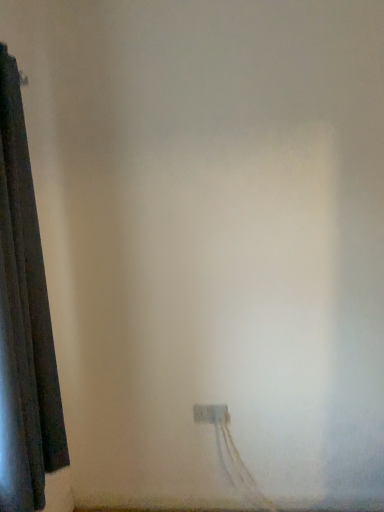
Question: Should I look upward or downward to see white plastic power plugs and sockets at lower center?

Choices:
 (A) up
 (B) down

Answer: (B)

Question: Is there a large distance between white plastic power plugs and sockets at lower center and dark fabric curtain at left?

Choices:
 (A) yes
 (B) no

Answer: (B)

Question: Is dark fabric curtain at left completely or partially inside white plastic power plugs and sockets at lower center?

Choices:
 (A) no
 (B) yes

Answer: (A)

Question: Considering the relative sizes of white plastic power plugs and sockets at lower center and dark fabric curtain at left in the image provided, is white plastic power plugs and sockets at lower center bigger than dark fabric curtain at left?

Choices:
 (A) no
 (B) yes

Answer: (A)

Question: Does white plastic power plugs and sockets at lower center have a greater width compared to dark fabric curtain at left?

Choices:
 (A) no
 (B) yes

Answer: (A)

Question: Is white plastic power plugs and sockets at lower center oriented towards dark fabric curtain at left?

Choices:
 (A) yes
 (B) no

Answer: (B)

Question: Considering the relative sizes of white plastic power plugs and sockets at lower center and dark fabric curtain at left in the image provided, is white plastic power plugs and sockets at lower center taller than dark fabric curtain at left?

Choices:
 (A) no
 (B) yes

Answer: (A)

Question: Does dark fabric curtain at left have a larger size compared to white plastic power plugs and sockets at lower center?

Choices:
 (A) yes
 (B) no

Answer: (A)

Question: Can you confirm if dark fabric curtain at left is shorter than white plastic power plugs and sockets at lower center?

Choices:
 (A) no
 (B) yes

Answer: (A)

Question: Does dark fabric curtain at left lie behind white plastic power plugs and sockets at lower center?

Choices:
 (A) no
 (B) yes

Answer: (A)

Question: Is dark fabric curtain at left with white plastic power plugs and sockets at lower center?

Choices:
 (A) no
 (B) yes

Answer: (A)

Question: Could white plastic power plugs and sockets at lower center be considered to be inside dark fabric curtain at left?

Choices:
 (A) no
 (B) yes

Answer: (A)

Question: Is dark fabric curtain at left at the left side of white plastic power plugs and sockets at lower center?

Choices:
 (A) no
 (B) yes

Answer: (B)

Question: In the image, is white plastic power plugs and sockets at lower center positioned in front of or behind dark fabric curtain at left?

Choices:
 (A) front
 (B) behind

Answer: (B)